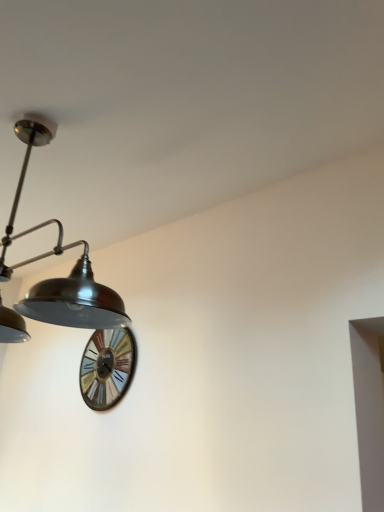
Describe the element at coordinates (107, 367) in the screenshot. The height and width of the screenshot is (512, 384). I see `wooden wall clock at upper center` at that location.

At what (x,y) coordinates should I click in order to perform the action: click on wooden wall clock at upper center. Please return your answer as a coordinate pair (x, y). The image size is (384, 512). Looking at the image, I should click on (107, 367).

Find the location of `wooden wall clock at upper center`. wooden wall clock at upper center is located at coordinates (107, 367).